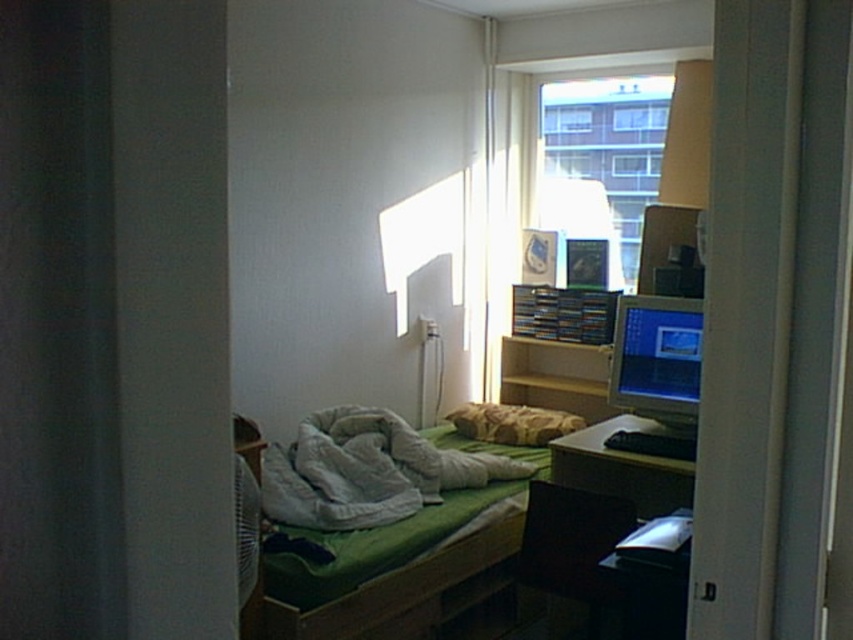
Question: Is black plastic computer desk at lower right thinner than patterned fabric pillow at center?

Choices:
 (A) no
 (B) yes

Answer: (B)

Question: Estimate the real-world distances between objects in this image. Which object is closer to the green fabric bed at center?

Choices:
 (A) wooden desk at right
 (B) patterned fabric pillow at center

Answer: (A)

Question: Does matte silver monitor at right appear over patterned fabric pillow at center?

Choices:
 (A) yes
 (B) no

Answer: (A)

Question: Which is farther from the matte silver monitor at right?

Choices:
 (A) wooden desk at right
 (B) patterned fabric pillow at center

Answer: (B)

Question: Considering the real-world distances, which object is farthest from the green fabric bed at center?

Choices:
 (A) wooden desk at right
 (B) black plastic computer desk at lower right

Answer: (B)

Question: Does transparent glass window at upper center have a larger size compared to black plastic computer desk at lower right?

Choices:
 (A) no
 (B) yes

Answer: (B)